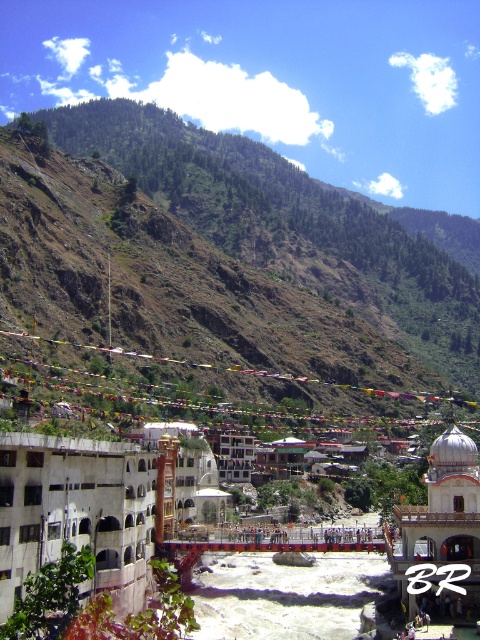
Question: Which point is closer to the camera taking this photo?

Choices:
 (A) (312, 291)
 (B) (59, 449)
 (C) (474, 486)

Answer: (B)

Question: Can you confirm if green grassy hillside at upper center is positioned above white stucco building at center?

Choices:
 (A) yes
 (B) no

Answer: (A)

Question: Considering the real-world distances, which object is closest to the green grassy hillside at upper center?

Choices:
 (A) white stucco building at center
 (B) white marble dome at center

Answer: (B)

Question: Can you confirm if green grassy hillside at upper center is bigger than white stucco building at center?

Choices:
 (A) yes
 (B) no

Answer: (A)

Question: Among these points, which one is nearest to the camera?

Choices:
 (A) (37, 449)
 (B) (399, 573)

Answer: (A)

Question: Is white stucco building at center to the right of white marble dome at center from the viewer's perspective?

Choices:
 (A) yes
 (B) no

Answer: (B)